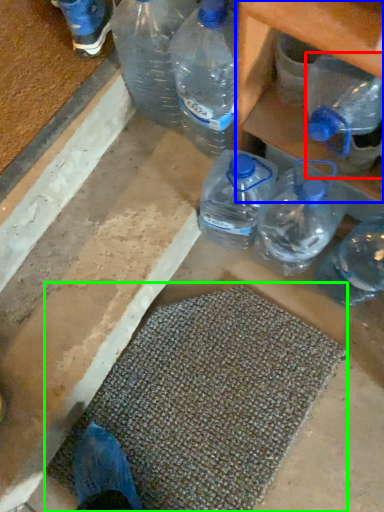
Question: Estimate the real-world distances between objects in this image. Which object is farther from bottle (highlighted by a red box), shelf (highlighted by a blue box) or bath mat (highlighted by a green box)?

Choices:
 (A) shelf
 (B) bath mat

Answer: (B)